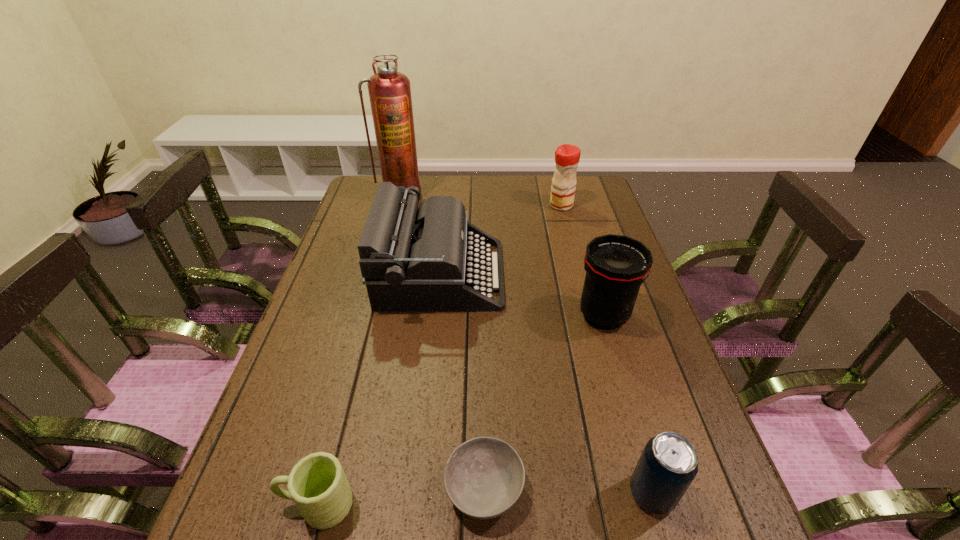
You are a GUI agent. You are given a task and a screenshot of the screen. Output one action in this format:
    pyautogui.click(x=<x>, y=<y>)
    Task: Click on the tallest object
    Image resolution: width=960 pixels, height=540 pixels.
    Given the screenshot: What is the action you would take?
    pyautogui.click(x=389, y=91)

Where is `condiment`? condiment is located at coordinates (567, 157).

Where is `typewriter`? typewriter is located at coordinates (412, 260).

The height and width of the screenshot is (540, 960). I want to click on telephoto lens, so click(616, 266).

The width and height of the screenshot is (960, 540). I want to click on soda can, so click(668, 464).

Locate an element on the screen. mug is located at coordinates (317, 484).

This screenshot has width=960, height=540. I want to click on bowl, so click(x=484, y=477).

The height and width of the screenshot is (540, 960). What are the coordinates of `vacant space located 0.080m on the side of the fire extinguisher with the label` in the screenshot? It's located at click(394, 220).

What are the coordinates of `vacant space positioned 0.130m on the right of the condiment` in the screenshot? It's located at (609, 205).

The image size is (960, 540). What are the coordinates of `blank space located on the typing side of the typewriter` in the screenshot? It's located at (597, 274).